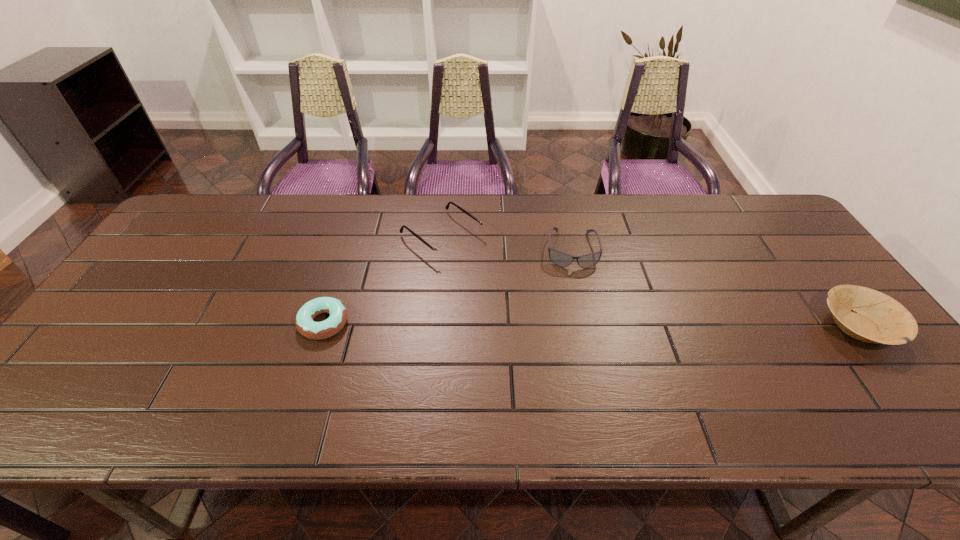
The width and height of the screenshot is (960, 540). I want to click on free space between the rightmost object and the spectacles, so click(x=650, y=281).

Where is `object that is the third closest to the third object from right to left`? This screenshot has height=540, width=960. object that is the third closest to the third object from right to left is located at coordinates (876, 318).

Identify which object is the second nearest to the spectacles. Please provide its 2D coordinates. Your answer should be formatted as a tuple, i.e. [(x, y)], where the tuple contains the x and y coordinates of a point satisfying the conditions above.

[(559, 258)]

The image size is (960, 540). What are the coordinates of `free spot that satisfies the following two spatial constraints: 1. on the front side of the rightmost object; 2. on the right side of the shortest object` in the screenshot? It's located at (323, 327).

Identify the location of free location that satisfies the following two spatial constraints: 1. on the front side of the shortest object; 2. on the left side of the bowl. This screenshot has height=540, width=960. (323, 327).

This screenshot has width=960, height=540. Find the location of `free space that satisfies the following two spatial constraints: 1. on the front side of the rightmost object; 2. on the left side of the doughnut`. free space that satisfies the following two spatial constraints: 1. on the front side of the rightmost object; 2. on the left side of the doughnut is located at coordinates (323, 327).

Find the location of `vacant position in the image that satisfies the following two spatial constraints: 1. on the front side of the bowl; 2. on the right side of the spectacles`. vacant position in the image that satisfies the following two spatial constraints: 1. on the front side of the bowl; 2. on the right side of the spectacles is located at coordinates (433, 327).

Where is `free space in the image that satisfies the following two spatial constraints: 1. on the front side of the third object from right to left; 2. on the right side of the bowl`? The image size is (960, 540). free space in the image that satisfies the following two spatial constraints: 1. on the front side of the third object from right to left; 2. on the right side of the bowl is located at coordinates (433, 327).